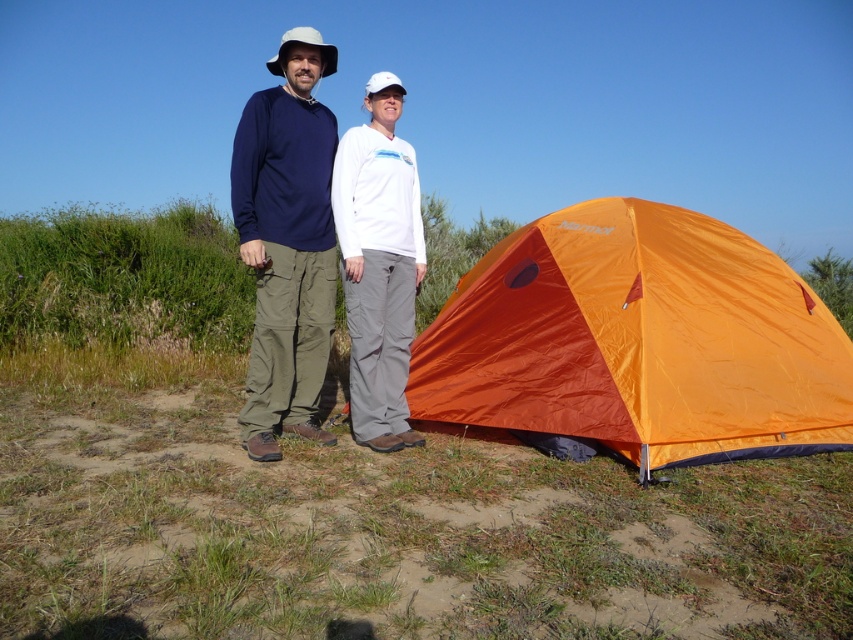
You are standing at the center of the image and want to find the orange nylon tent at lower right. In which direction should you look to locate it?

The orange nylon tent at lower right is located at the point with coordinates 0.533 on the x axis and 0.749 on the y axis. Since you are at the center, you should look towards the lower right direction to find it.

You are a fashion designer observing the two individuals in the image. You need to determine which clothing item, the matte blue shirt at center or the white matte pants at center, would require more fabric to produce. Based on the visual information provided, which one would you choose?

The matte blue shirt at center is larger in size than the white matte pants at center, so it would require more fabric to produce.